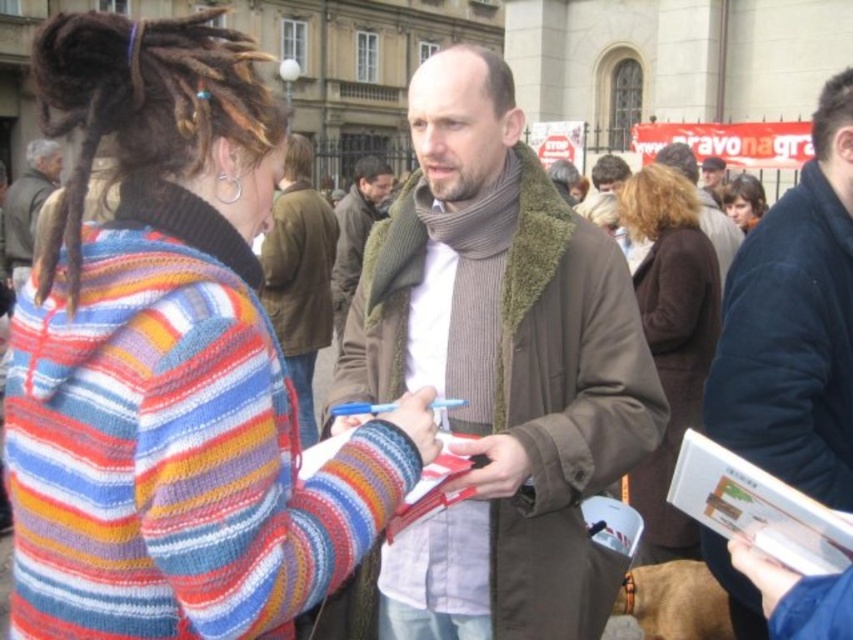
Question: Estimate the real-world distances between objects in this image. Which object is farther from the brown wool scarf at center?

Choices:
 (A) smooth brown hair at upper right
 (B) knitted wool sweater at center

Answer: (A)

Question: Is knitted wool sweater at center behind dark blue fleece jacket at center?

Choices:
 (A) yes
 (B) no

Answer: (B)

Question: Which of the following is the farthest from the observer?

Choices:
 (A) smooth brown hair at upper right
 (B) knitted wool sweater at center

Answer: (A)

Question: Can you confirm if brown wool coat at center is positioned above dark brown leather jacket at center?

Choices:
 (A) yes
 (B) no

Answer: (B)

Question: Does knitted wool sweater at center lie in front of striped sweater at center?

Choices:
 (A) no
 (B) yes

Answer: (B)

Question: Which point is closer to the camera?

Choices:
 (A) dark blue fleece jacket at center
 (B) dark brown leather jacket at center
 (C) brown wool scarf at center
 (D) smooth brown hair at upper right

Answer: (A)